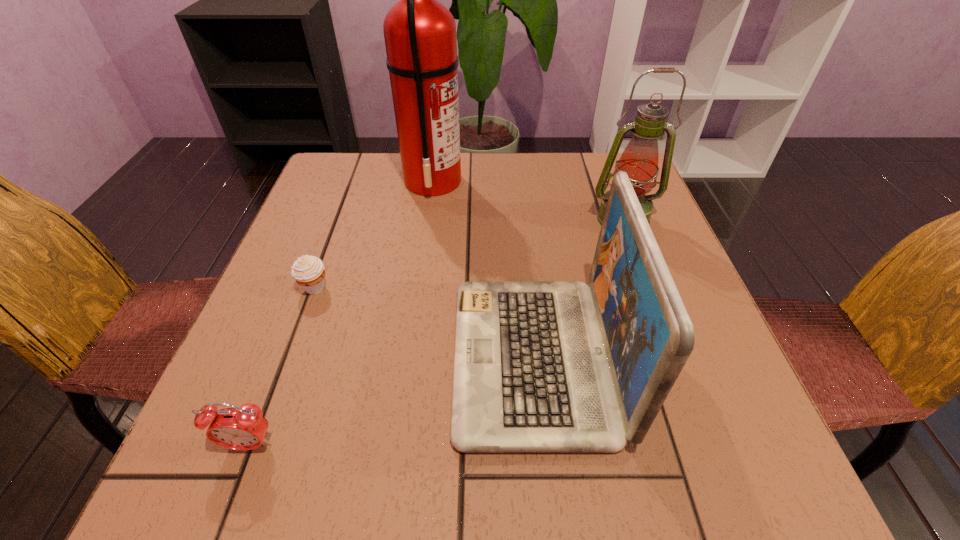
Find the location of a particular element. This screenshot has height=540, width=960. object that is at the right edge is located at coordinates (639, 160).

Identify the location of object located in the near left corner section of the desktop. Image resolution: width=960 pixels, height=540 pixels. (244, 428).

Where is `object that is positioned at the far right corner`? object that is positioned at the far right corner is located at coordinates (639, 160).

You are a GUI agent. You are given a task and a screenshot of the screen. Output one action in this format:
    pyautogui.click(x=<x>, y=<y>)
    Task: Click on the free space at the far edge of the desktop
    The width and height of the screenshot is (960, 540).
    Given the screenshot: What is the action you would take?
    pyautogui.click(x=474, y=172)

In the image, there is a desktop. Where is `vacant space at the near edge`? The width and height of the screenshot is (960, 540). vacant space at the near edge is located at coordinates (319, 467).

Locate an element on the screen. The width and height of the screenshot is (960, 540). vacant space at the left edge of the desktop is located at coordinates (341, 214).

You are a GUI agent. You are given a task and a screenshot of the screen. Output one action in this format:
    pyautogui.click(x=<x>, y=<y>)
    Task: Click on the free location at the far left corner
    
    Given the screenshot: What is the action you would take?
    pyautogui.click(x=361, y=185)

At what (x,y) coordinates should I click in order to perform the action: click on vacant space at the far right corner. Please return your answer as a coordinate pair (x, y). The width and height of the screenshot is (960, 540). Looking at the image, I should click on (584, 172).

In the image, there is a desktop. Identify the location of free region at the near right corner. (759, 472).

The width and height of the screenshot is (960, 540). What are the coordinates of `free spot between the alarm clock and the fire extinguisher` in the screenshot? It's located at (342, 313).